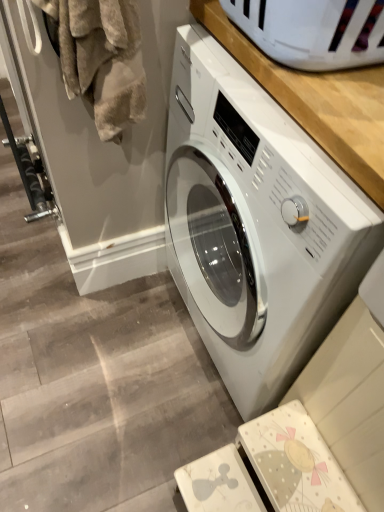
Question: Based on their positions, is fuzzy beige towel at left located to the left or right of white glossy washing machine at center?

Choices:
 (A) left
 (B) right

Answer: (A)

Question: From the image's perspective, relative to white glossy washing machine at center, is fuzzy beige towel at left above or below?

Choices:
 (A) below
 (B) above

Answer: (B)

Question: Is point (107, 103) positioned closer to the camera than point (241, 377)?

Choices:
 (A) farther
 (B) closer

Answer: (B)

Question: Is white glossy washing machine at center bigger or smaller than fuzzy beige towel at left?

Choices:
 (A) small
 (B) big

Answer: (B)

Question: From the image's perspective, relative to fuzzy beige towel at left, is white glossy washing machine at center above or below?

Choices:
 (A) above
 (B) below

Answer: (B)

Question: From a real-world perspective, relative to fuzzy beige towel at left, is white glossy washing machine at center vertically above or below?

Choices:
 (A) above
 (B) below

Answer: (B)

Question: Would you say white glossy washing machine at center is to the left or to the right of fuzzy beige towel at left in the picture?

Choices:
 (A) right
 (B) left

Answer: (A)